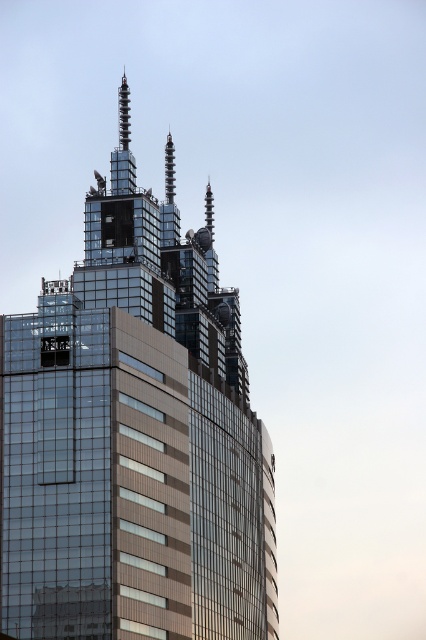
Who is shorter, glassy metallic skyscraper at center or shiny metallic spire at center?

With less height is shiny metallic spire at center.

Where is `glassy metallic skyscraper at center`? This screenshot has height=640, width=426. glassy metallic skyscraper at center is located at coordinates (134, 440).

The height and width of the screenshot is (640, 426). I want to click on glassy metallic skyscraper at center, so click(x=134, y=440).

Is point (170, 173) more distant than point (209, 196)?

No, (170, 173) is closer to viewer.

Which is in front, point (166, 144) or point (209, 227)?

Point (209, 227) is in front.

At what (x,y) coordinates should I click in order to perform the action: click on shiny metallic spire at center. Please return your answer as a coordinate pair (x, y). The image size is (426, 640). Looking at the image, I should click on (169, 170).

Between point (218, 572) and point (206, 192), which one is positioned behind?

Positioned behind is point (206, 192).

What do you see at coordinates (134, 440) in the screenshot? I see `glassy metallic skyscraper at center` at bounding box center [134, 440].

This screenshot has height=640, width=426. I want to click on glassy metallic skyscraper at center, so click(x=134, y=440).